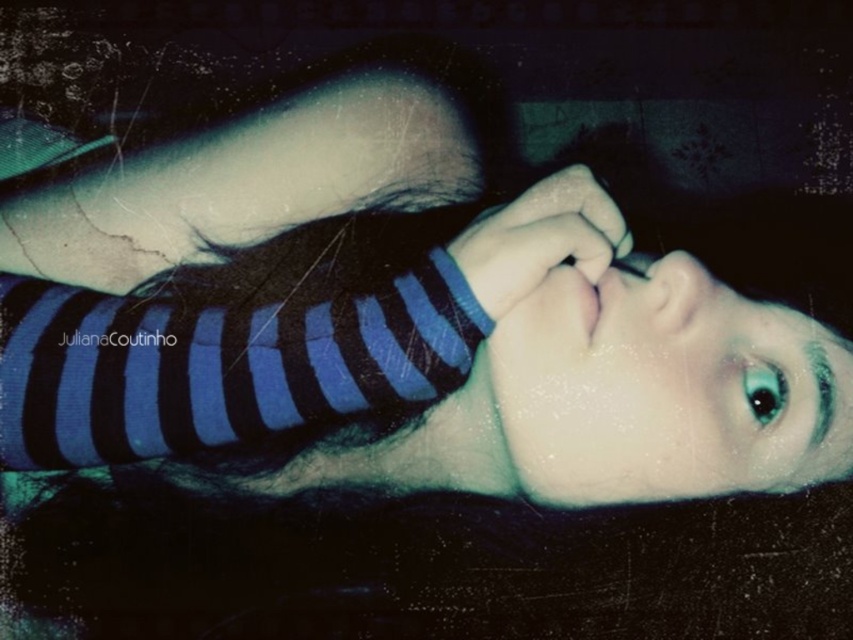
You are a photographer analyzing the image. You notice two points in the scene at coordinates point (650, 486) and point (814, 442). Which point is closer to the camera?

Point (650, 486) is further to the camera than point (814, 442), so the closer point to the camera is point (814, 442).

You are holding a 12 inch ruler and want to measure the distance from your eyes to the point marked at coordinates point (711,348) in the image. Can you reach it with the ruler?

The distance between point (711,348) and the viewer is 22.57 inches. Since the ruler is only 12 inches long, it cannot reach the required distance.

Looking at this image, you are a photographer analyzing this image. You notice a point at coordinates (390, 317). What object is located exactly at that point?

The blue striped shirt at center is located exactly at point (390, 317).